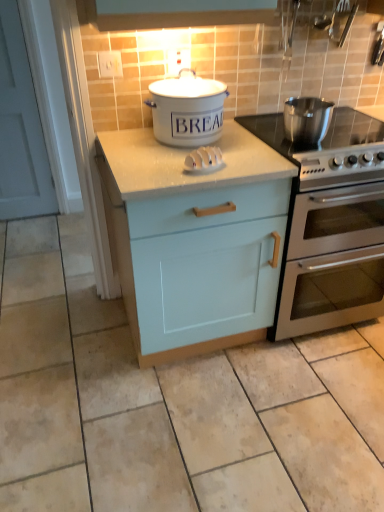
Question: Is point (205, 152) closer or farther from the camera than point (233, 312)?

Choices:
 (A) closer
 (B) farther

Answer: (A)

Question: Considering their positions, is white plastic knife block at center located in front of or behind light blue wood cabinet at center?

Choices:
 (A) behind
 (B) front

Answer: (A)

Question: Based on their relative distances, which object is farther from the polished stainless steel pot at right, the 1th kitchen appliance when ordered from right to left?

Choices:
 (A) white plastic knife block at center
 (B) stainless steel gas stove at right
 (C) stainless steel oven at right
 (D) light blue wood cabinet at center
 (E) white ceramic bread bin at center, acting as the 1th kitchen appliance starting from the left

Answer: (D)

Question: Which is farther from the light blue wood cabinet at center?

Choices:
 (A) polished stainless steel pot at right, acting as the second kitchen appliance starting from the left
 (B) white ceramic bread bin at center, acting as the 1th kitchen appliance starting from the left
 (C) stainless steel gas stove at right
 (D) white plastic knife block at center
 (E) stainless steel oven at right

Answer: (A)